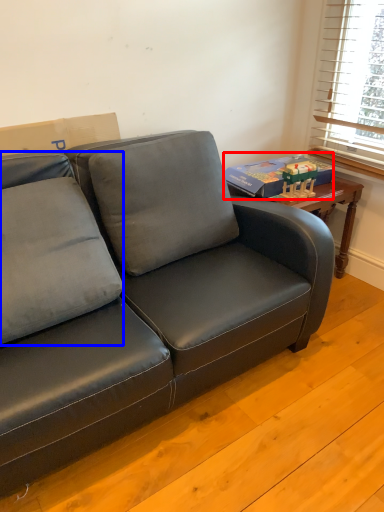
Question: Among these objects, which one is farthest to the camera, paperback book (highlighted by a red box) or pillow (highlighted by a blue box)?

Choices:
 (A) paperback book
 (B) pillow

Answer: (A)